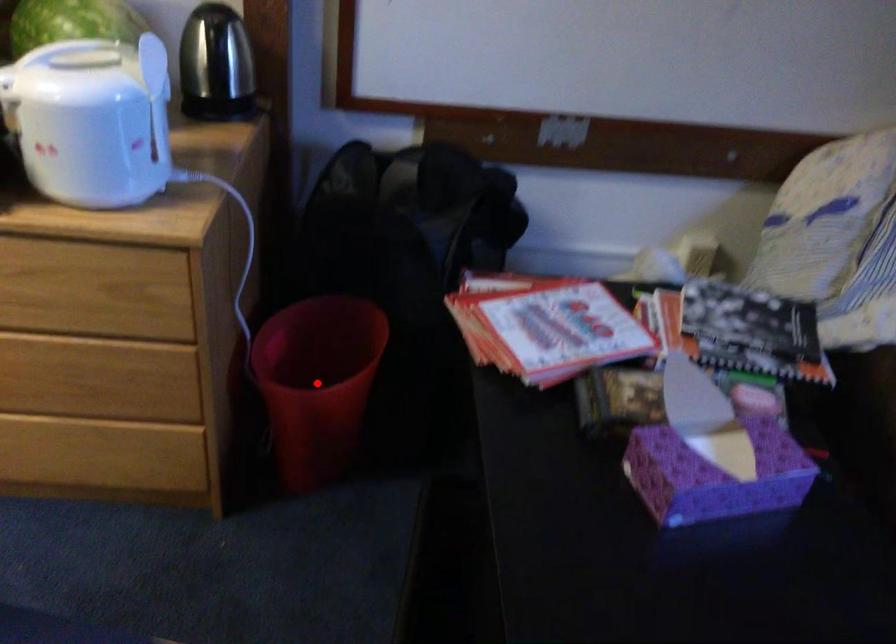
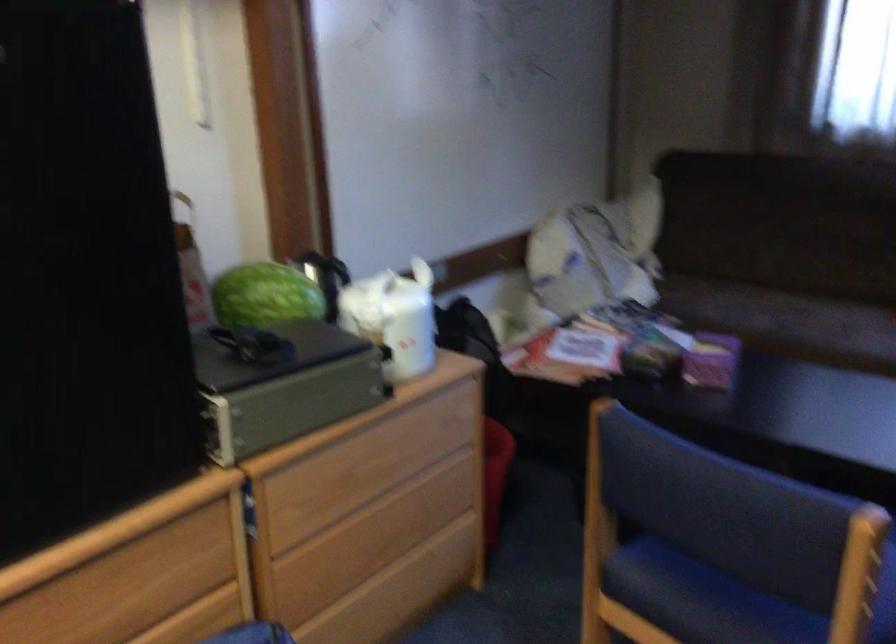
Question: I am providing you with two images of the same scene from different viewpoints. A red point is marked on the first image. Is the red point's position out of view in image 2?

Choices:
 (A) Yes
 (B) No

Answer: (A)